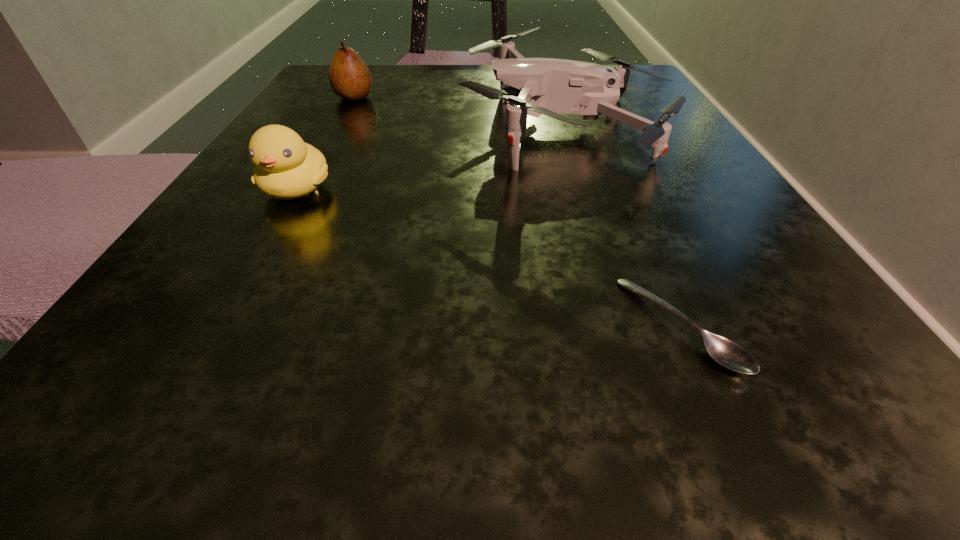
The width and height of the screenshot is (960, 540). Find the location of `free area in between the drone and the duckling`. free area in between the drone and the duckling is located at coordinates (431, 157).

Where is `free spot between the duckling and the shortest object`? This screenshot has width=960, height=540. free spot between the duckling and the shortest object is located at coordinates coord(488,258).

Image resolution: width=960 pixels, height=540 pixels. I want to click on blank region between the shortest object and the drone, so click(x=622, y=225).

Locate an element on the screen. vacant area that lies between the drone and the duckling is located at coordinates (431, 157).

Image resolution: width=960 pixels, height=540 pixels. What are the coordinates of `free spot between the drone and the pear` in the screenshot? It's located at (460, 111).

The height and width of the screenshot is (540, 960). I want to click on vacant space that is in between the duckling and the shortest object, so click(x=488, y=258).

The height and width of the screenshot is (540, 960). I want to click on the second closest object to the shortest object, so click(x=286, y=167).

Find the location of a particular element. object that is the closest to the duckling is located at coordinates (528, 86).

What are the coordinates of `blank area in the image that satisfies the following two spatial constraints: 1. with a camera at the front of the drone; 2. at the beak of the duckling` in the screenshot? It's located at (587, 190).

Where is `free space that satisfies the following two spatial constraints: 1. with a camera at the front of the drone; 2. at the beak of the duckling`? free space that satisfies the following two spatial constraints: 1. with a camera at the front of the drone; 2. at the beak of the duckling is located at coordinates (587, 190).